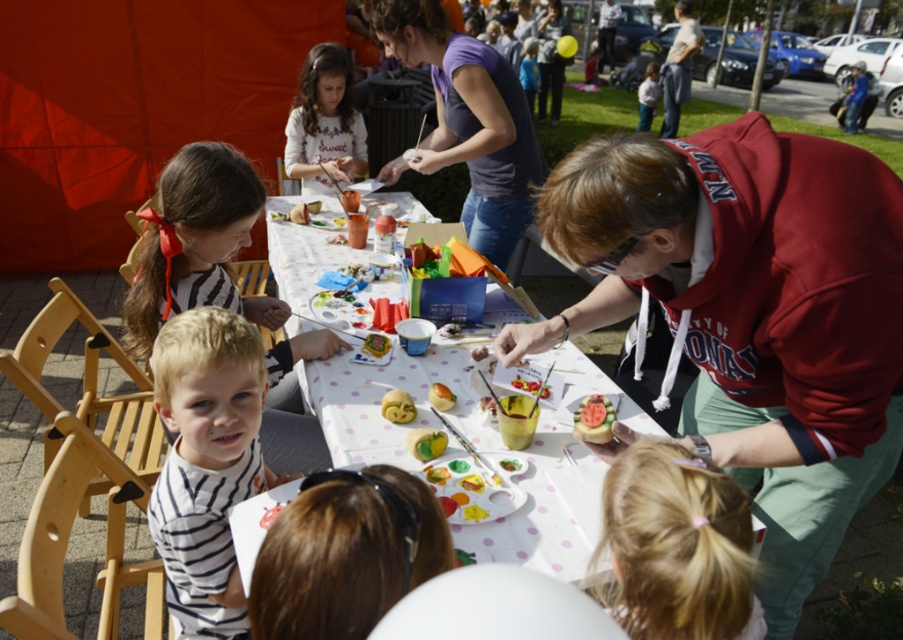
You are a participant in the food decoration activity and need to place a yellow doughnut at center on top of the white polka dot paper at center. Is this possible based on their sizes?

The white polka dot paper at center is taller than the yellow doughnut at center, so placing the yellow doughnut at center on top of the white polka dot paper at center is possible since the paper is taller and can support it.